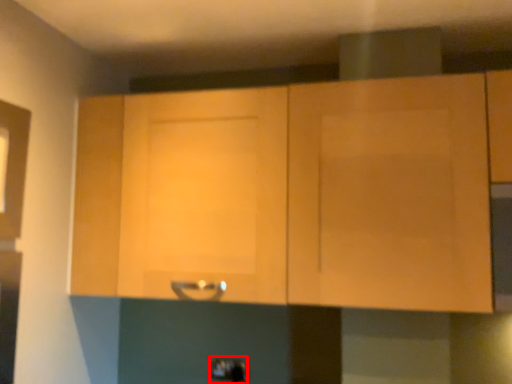
Question: From the image's perspective, what is the correct spatial positioning of door handle (annotated by the red box) in reference to cabinetry?

Choices:
 (A) above
 (B) below

Answer: (B)